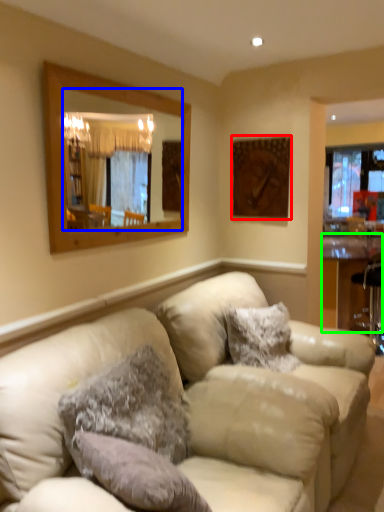
Question: Estimate the real-world distances between objects in this image. Which object is closer to picture frame (highlighted by a red box), mirror (highlighted by a blue box) or table (highlighted by a green box)?

Choices:
 (A) mirror
 (B) table

Answer: (A)